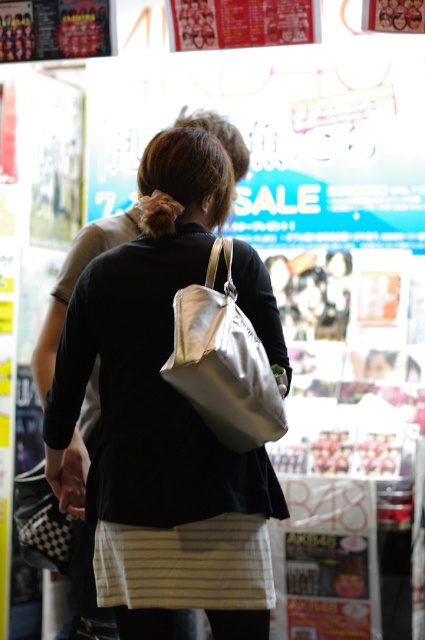
Question: Which object is positioned closest to the white striped apron at lower center?

Choices:
 (A) white fabric shoulder bag at center
 (B) white fabric bag at center

Answer: (B)

Question: Which of the following is the farthest from the observer?

Choices:
 (A) (178, 305)
 (B) (170, 195)

Answer: (B)

Question: Which of the following is the farthest from the observer?

Choices:
 (A) (266, 566)
 (B) (243, 369)
 (C) (104, 563)

Answer: (C)

Question: Is white fabric bag at center bigger than white striped apron at lower center?

Choices:
 (A) no
 (B) yes

Answer: (B)

Question: Is white fabric bag at center wider than white striped apron at lower center?

Choices:
 (A) no
 (B) yes

Answer: (B)

Question: Can you confirm if white striped apron at lower center is positioned to the right of white fabric shoulder bag at center?

Choices:
 (A) no
 (B) yes

Answer: (A)